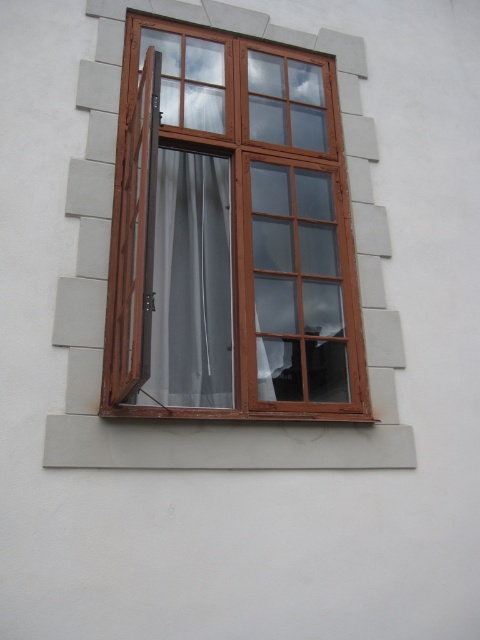
Based on the photo, can you confirm if brown wooden window at center is positioned below satin gray curtain at center?

Actually, brown wooden window at center is above satin gray curtain at center.

Is point (285, 266) farther from camera compared to point (180, 243)?

Yes, point (285, 266) is farther from viewer.

Identify the location of brown wooden window at center. (240, 234).